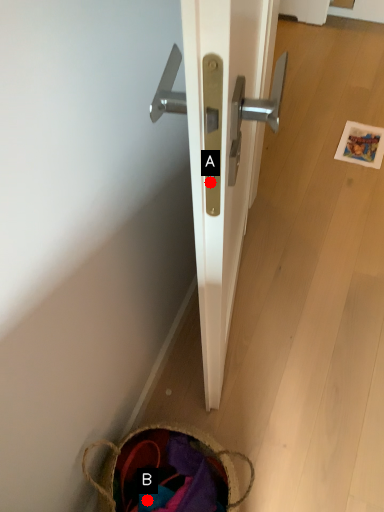
Question: Two points are circled on the image, labeled by A and B beside each circle. Which point is closer to the camera?

Choices:
 (A) A is closer
 (B) B is closer

Answer: (A)